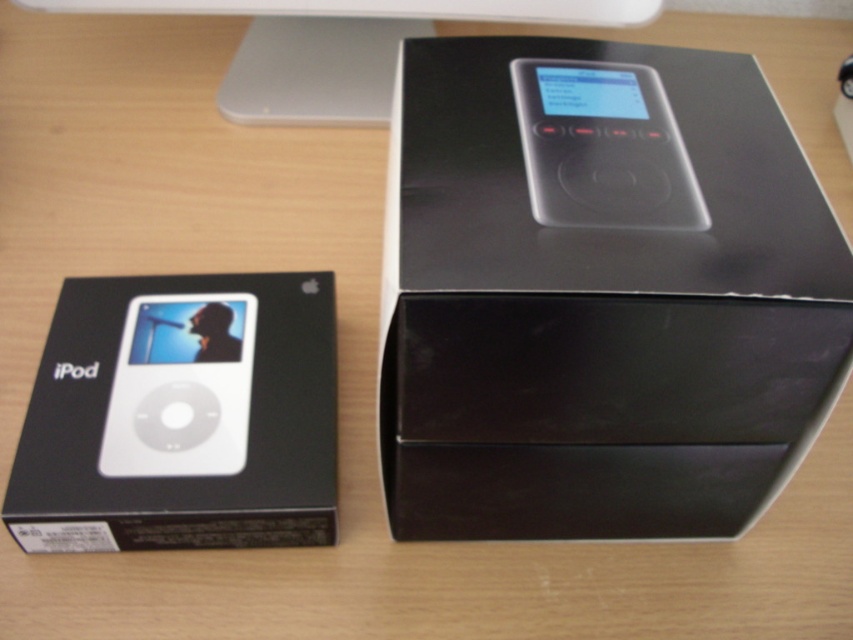
Question: Does black matte box at upper center have a greater width compared to white matte ipod at center?

Choices:
 (A) no
 (B) yes

Answer: (B)

Question: Is white matte ipod at center positioned at the back of white plastic desktop computer at upper center?

Choices:
 (A) yes
 (B) no

Answer: (B)

Question: Which point is closer to the camera taking this photo?

Choices:
 (A) [x=225, y=384]
 (B) [x=708, y=403]

Answer: (B)

Question: Which point appears farthest from the camera in this image?

Choices:
 (A) (186, 500)
 (B) (108, 422)
 (C) (604, 307)
 (D) (288, 20)

Answer: (D)

Question: Can you confirm if black matte box at upper center is positioned to the right of white plastic desktop computer at upper center?

Choices:
 (A) no
 (B) yes

Answer: (B)

Question: Which object is the closest to the white plastic desktop computer at upper center?

Choices:
 (A) white glossy ipod at center
 (B) white matte ipod at center
 (C) black matte box at upper center
 (D) satin black ipod at center

Answer: (D)